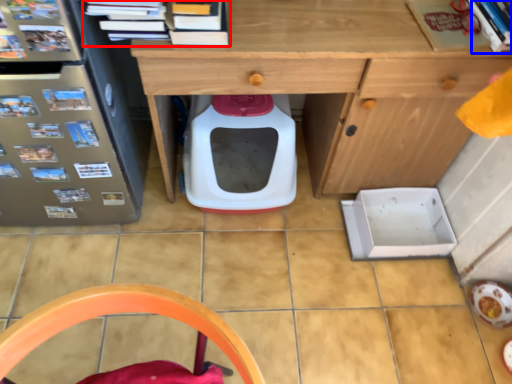
Question: Among these objects, which one is farthest to the camera, book (highlighted by a red box) or book (highlighted by a blue box)?

Choices:
 (A) book
 (B) book

Answer: (B)